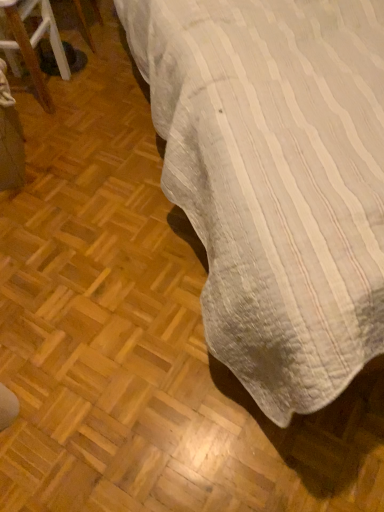
Question: Can you confirm if black fabric bag at left is shorter than white striped fabric at upper right?

Choices:
 (A) yes
 (B) no

Answer: (A)

Question: Is the depth of black fabric bag at left greater than that of white striped fabric at upper right?

Choices:
 (A) no
 (B) yes

Answer: (B)

Question: From the image's perspective, would you say black fabric bag at left is positioned over white striped fabric at upper right?

Choices:
 (A) yes
 (B) no

Answer: (A)

Question: Can you confirm if black fabric bag at left is positioned to the left of white striped fabric at upper right?

Choices:
 (A) yes
 (B) no

Answer: (A)

Question: From a real-world perspective, is black fabric bag at left beneath white striped fabric at upper right?

Choices:
 (A) yes
 (B) no

Answer: (A)

Question: Does black fabric bag at left have a lesser width compared to white striped fabric at upper right?

Choices:
 (A) no
 (B) yes

Answer: (B)

Question: Is black fabric bag at left located within white striped fabric at upper right?

Choices:
 (A) yes
 (B) no

Answer: (B)

Question: Could you tell me if white striped fabric at upper right is facing black fabric bag at left?

Choices:
 (A) yes
 (B) no

Answer: (B)

Question: Is white striped fabric at upper right to the right of black fabric bag at left from the viewer's perspective?

Choices:
 (A) yes
 (B) no

Answer: (A)

Question: Considering the relative sizes of white striped fabric at upper right and black fabric bag at left in the image provided, is white striped fabric at upper right taller than black fabric bag at left?

Choices:
 (A) no
 (B) yes

Answer: (B)

Question: From the image's perspective, is white striped fabric at upper right located beneath black fabric bag at left?

Choices:
 (A) yes
 (B) no

Answer: (A)

Question: Does white striped fabric at upper right appear on the left side of black fabric bag at left?

Choices:
 (A) no
 (B) yes

Answer: (A)

Question: Relative to white striped fabric at upper right, is black fabric bag at left in front or behind?

Choices:
 (A) front
 (B) behind

Answer: (B)